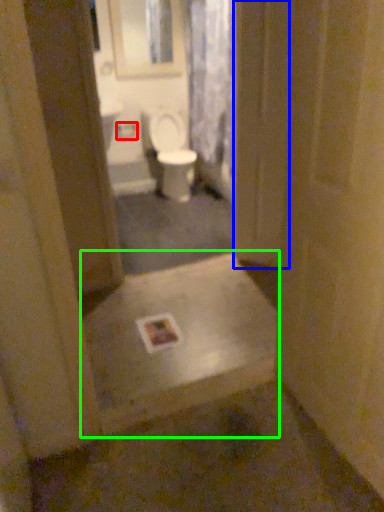
Question: Which object is the closest to the toilet paper (highlighted by a red box)? Choose among these: screen door (highlighted by a blue box) or landing (highlighted by a green box).

Choices:
 (A) screen door
 (B) landing

Answer: (A)